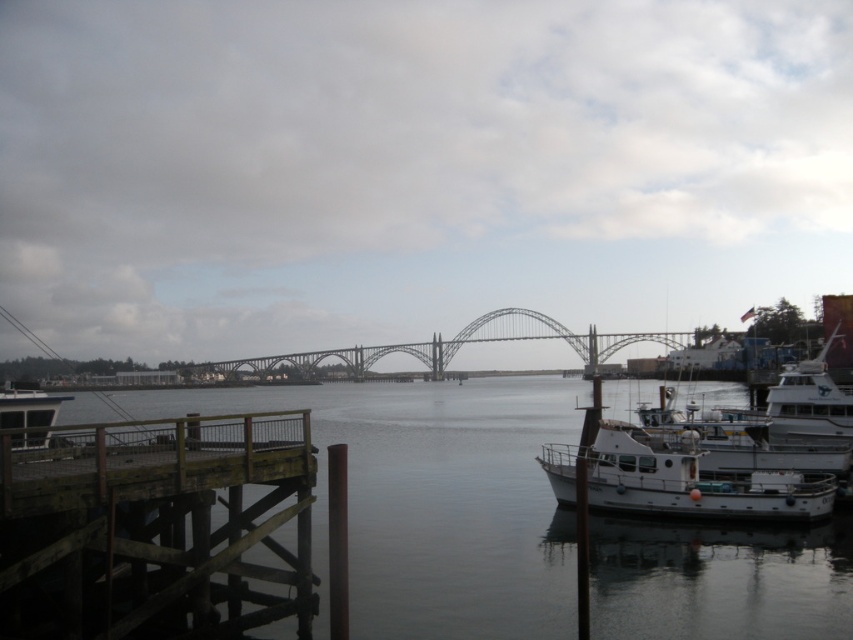
Question: Where is smooth gray water at center located in relation to metallic gray bridge at center in the image?

Choices:
 (A) left
 (B) right

Answer: (B)

Question: Does smooth gray water at center have a lesser width compared to metallic gray bridge at center?

Choices:
 (A) no
 (B) yes

Answer: (B)

Question: Which object appears farthest from the camera in this image?

Choices:
 (A) white matte boat at lower right
 (B) brown wooden dock at lower left
 (C) metallic gray bridge at center
 (D) white glossy boat at left

Answer: (C)

Question: Does white matte boat at lower right have a larger size compared to metallic gray bridge at center?

Choices:
 (A) no
 (B) yes

Answer: (A)

Question: Which object is positioned closest to the metallic gray bridge at center?

Choices:
 (A) white matte boat at lower right
 (B) brown wooden dock at lower left
 (C) white glossy boat at left

Answer: (C)

Question: Considering the real-world distances, which object is farthest from the white glossy boat at left?

Choices:
 (A) white matte boat at lower right
 (B) brown wooden dock at lower left

Answer: (A)